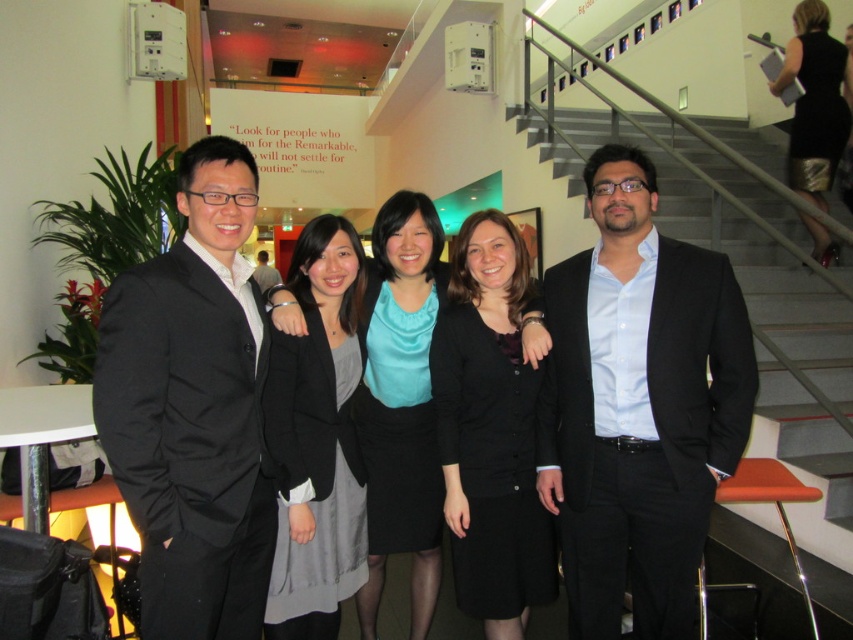
Question: Which object is farther from the camera taking this photo?

Choices:
 (A) gold metallic skirt at upper right
 (B) matte black blazer at center
 (C) matte black suit at right

Answer: (A)

Question: Based on their relative distances, which object is farther from the matte black suit at right?

Choices:
 (A) matte black blazer at center
 (B) gold metallic skirt at upper right

Answer: (B)

Question: Considering the relative positions of matte black suit at left and matte black blazer at center in the image provided, where is matte black suit at left located with respect to matte black blazer at center?

Choices:
 (A) above
 (B) below

Answer: (A)

Question: Is matte black suit at right smaller than matte teal blouse at center?

Choices:
 (A) no
 (B) yes

Answer: (A)

Question: Is matte black suit at left smaller than matte teal blouse at center?

Choices:
 (A) no
 (B) yes

Answer: (B)

Question: Which of the following is the farthest from the observer?

Choices:
 (A) (529, 310)
 (B) (526, 394)
 (C) (809, 13)

Answer: (C)